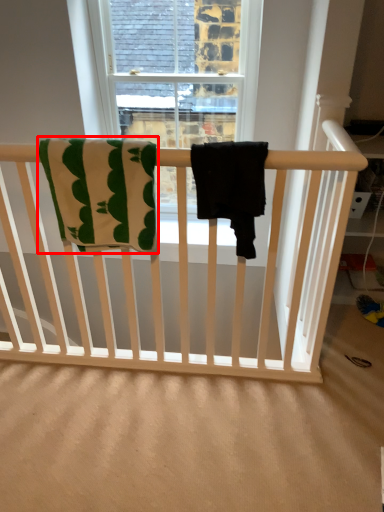
Question: From the image's perspective, where is beach towel (annotated by the red box) located in relation to beach towel in the image?

Choices:
 (A) above
 (B) below

Answer: (A)